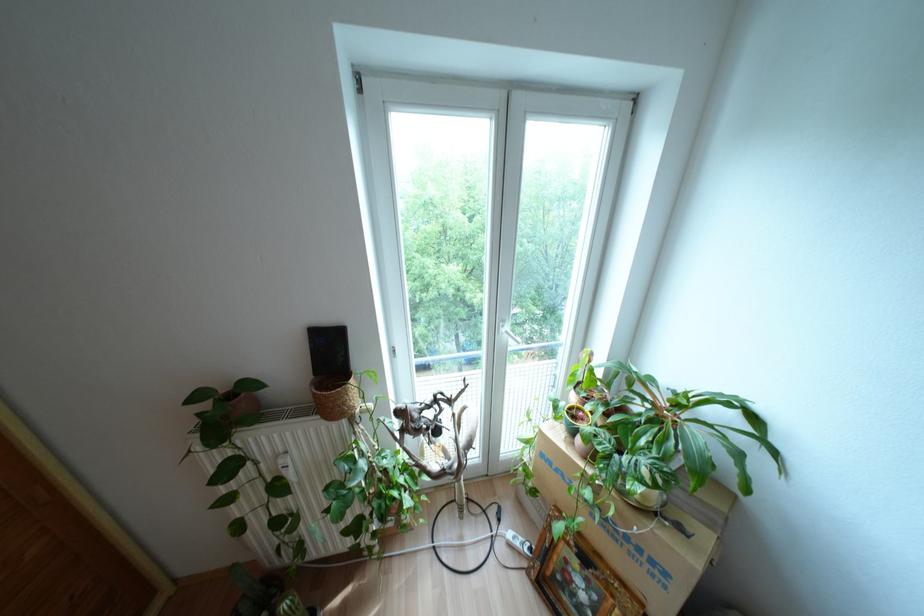
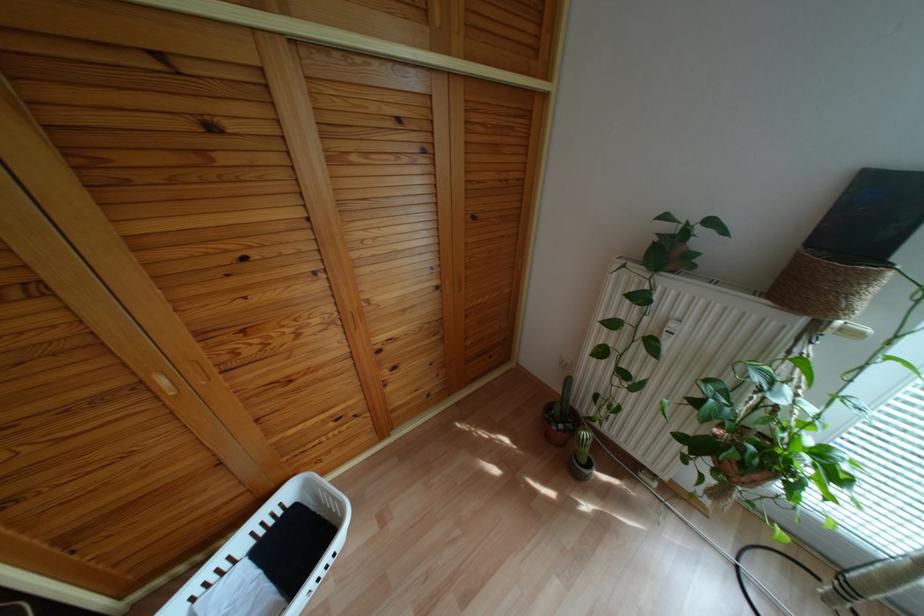
Where in the second image is the point corresponding to pixel 357 408 from the first image?

(839, 322)